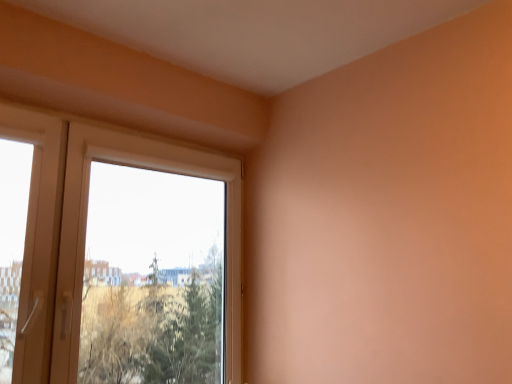
Question: Is white glossy door at left taller or shorter than white plastic window at upper left?

Choices:
 (A) short
 (B) tall

Answer: (A)

Question: Looking at their shapes, would you say white glossy door at left is wider or thinner than white plastic window at upper left?

Choices:
 (A) wide
 (B) thin

Answer: (B)

Question: Considering the positions of white glossy door at left and white plastic window at upper left in the image, is white glossy door at left bigger or smaller than white plastic window at upper left?

Choices:
 (A) big
 (B) small

Answer: (B)

Question: Based on their positions, is white plastic window at upper left located to the left or right of white glossy door at left?

Choices:
 (A) right
 (B) left

Answer: (A)

Question: In the image, is white plastic window at upper left positioned in front of or behind white glossy door at left?

Choices:
 (A) front
 (B) behind

Answer: (B)

Question: Is white plastic window at upper left wider or thinner than white glossy door at left?

Choices:
 (A) wide
 (B) thin

Answer: (A)

Question: Considering the positions of white plastic window at upper left and white glossy door at left in the image, is white plastic window at upper left bigger or smaller than white glossy door at left?

Choices:
 (A) small
 (B) big

Answer: (B)